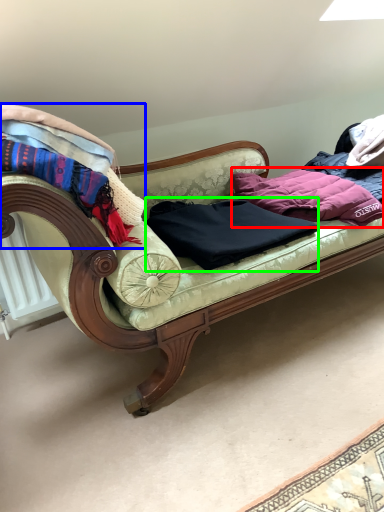
Question: Considering the real-world distances, which object is farthest from clothing (highlighted by a red box)? blanket (highlighted by a blue box) or clothing (highlighted by a green box)?

Choices:
 (A) blanket
 (B) clothing

Answer: (A)